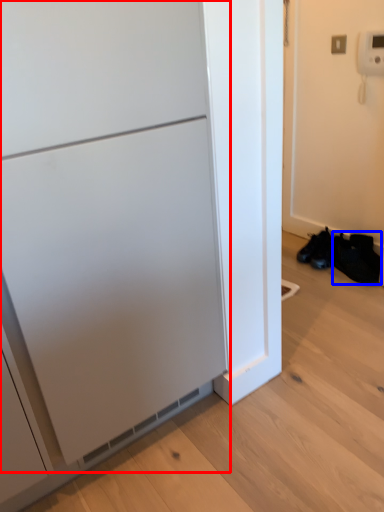
Question: Among these objects, which one is farthest to the camera, appliance (highlighted by a red box) or shoe (highlighted by a blue box)?

Choices:
 (A) appliance
 (B) shoe

Answer: (B)